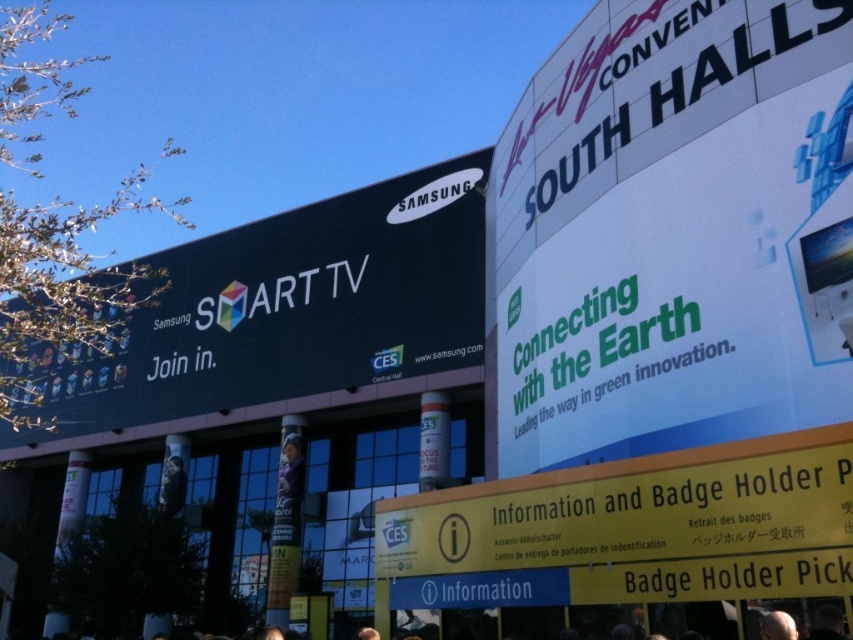
You are a photographer standing at a certain point and want to take a photo of the black matte sign at upper left. If your camera has a maximum focus range of 50 meters, will it be able to capture the sign clearly?

The black matte sign at upper left and camera are 52.32 meters apart, which exceeds the camera maximum focus range of 50 meters. Therefore, the camera cannot capture the sign clearly.